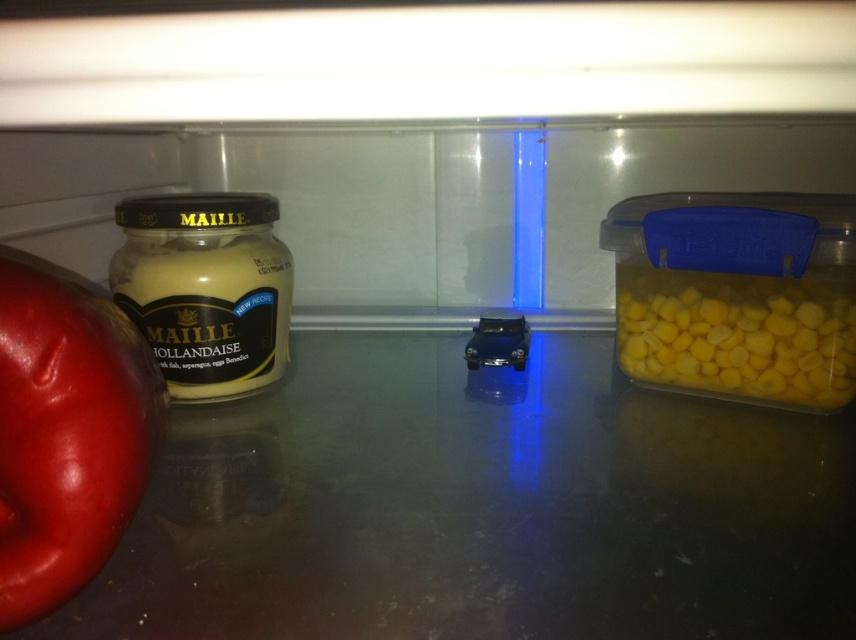
Question: Is shiny red apple at left in front of matte yellow mustard at left?

Choices:
 (A) yes
 (B) no

Answer: (A)

Question: Considering the real-world distances, which object is farthest from the metallic blue toy car at center?

Choices:
 (A) shiny red apple at left
 (B) matte yellow mustard at left

Answer: (A)

Question: Which object is closer to the camera taking this photo?

Choices:
 (A) metallic blue toy car at center
 (B) yellow matte corn at right

Answer: (B)

Question: Is shiny red apple at left positioned at the back of matte yellow mustard at left?

Choices:
 (A) yes
 (B) no

Answer: (B)

Question: Which point is closer to the camera?

Choices:
 (A) yellow matte corn at right
 (B) matte yellow mustard at left
 (C) shiny red apple at left

Answer: (C)

Question: Is shiny red apple at left behind yellow matte corn at right?

Choices:
 (A) no
 (B) yes

Answer: (A)